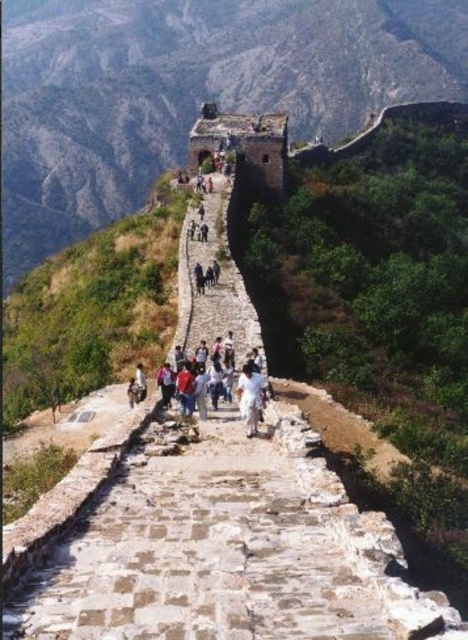
Question: Which object is closer to the camera taking this photo?

Choices:
 (A) white cotton shirt at center
 (B) brown stone wall at upper center

Answer: (A)

Question: In this image, where is brown stone wall at upper center located relative to white cotton shirt at center?

Choices:
 (A) left
 (B) right

Answer: (B)

Question: From the image, what is the correct spatial relationship of brown stone wall at upper center in relation to white cotton shirt at center?

Choices:
 (A) below
 (B) above

Answer: (B)

Question: Among these points, which one is nearest to the camera?

Choices:
 (A) (245, 12)
 (B) (205, 408)

Answer: (B)

Question: In this image, where is brown stone wall at upper center located relative to white cotton shirt at center?

Choices:
 (A) below
 (B) above

Answer: (B)

Question: Which of the following is the closest to the observer?

Choices:
 (A) (153, 80)
 (B) (241, 378)

Answer: (B)